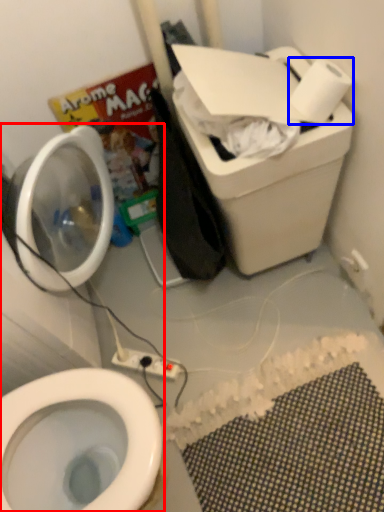
Question: Among these objects, which one is nearest to the camera, toiletries (highlighted by a red box) or toilet paper (highlighted by a blue box)?

Choices:
 (A) toiletries
 (B) toilet paper

Answer: (A)